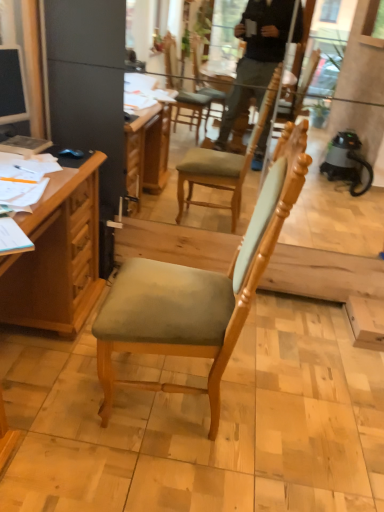
Locate an element on the screen. This screenshot has width=384, height=512. vacant area that is in front of blue matte computer mouse at upper left is located at coordinates (56, 164).